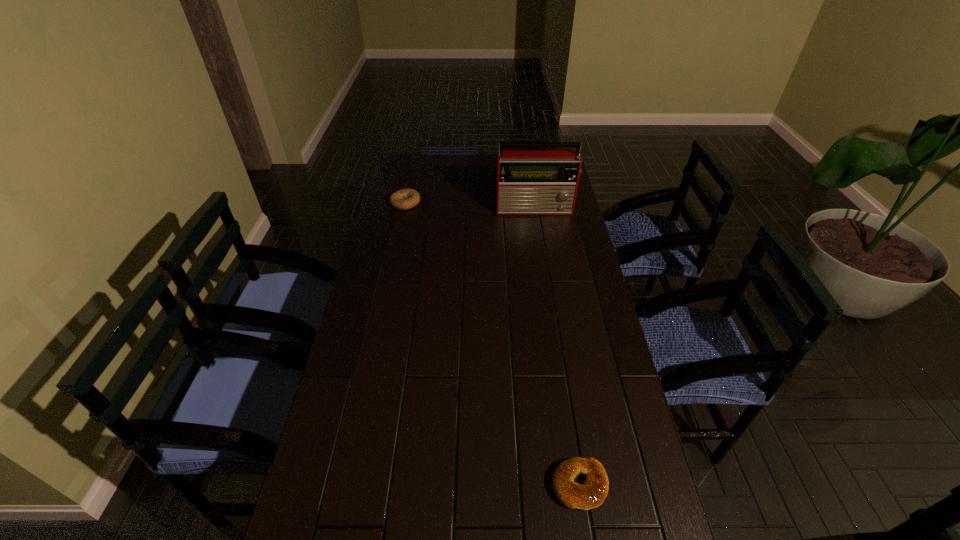
You are a GUI agent. You are given a task and a screenshot of the screen. Output one action in this format:
    pyautogui.click(x=<x>, y=<y>)
    Task: Click on the unoccupied position between the nearest object and the farther bagel
    This screenshot has width=960, height=540.
    Given the screenshot: What is the action you would take?
    tap(492, 344)

Image resolution: width=960 pixels, height=540 pixels. Identify the location of vacant area between the farther bagel and the tallest object. (470, 205).

This screenshot has height=540, width=960. What are the coordinates of `vacant area that lies between the tallest object and the left bagel` in the screenshot? It's located at (470, 205).

What are the coordinates of `free space that is in between the leftmost object and the right bagel` in the screenshot? It's located at (492, 344).

This screenshot has height=540, width=960. I want to click on free area in between the right bagel and the radio receiver, so click(558, 347).

This screenshot has height=540, width=960. I want to click on object that is the closest one to the tallest object, so click(x=403, y=199).

Select which object is the closest to the farther bagel. Please provide its 2D coordinates. Your answer should be formatted as a tuple, i.e. [(x, y)], where the tuple contains the x and y coordinates of a point satisfying the conditions above.

[(533, 178)]

Locate an element on the screen. vacant space that satisfies the following two spatial constraints: 1. on the front side of the leftmost object; 2. on the right side of the nearer bagel is located at coordinates pos(343,485).